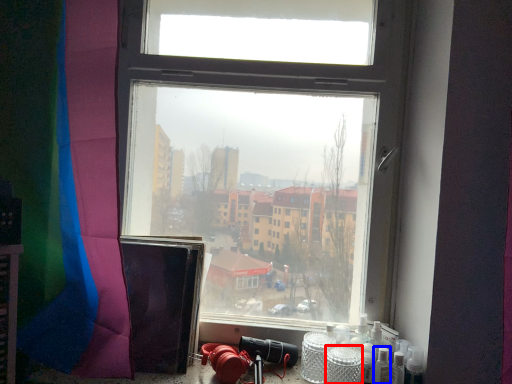
Question: Which of the following is the closest to the observer, glass jar (highlighted by a red box) or wine bottle (highlighted by a blue box)?

Choices:
 (A) glass jar
 (B) wine bottle

Answer: (A)